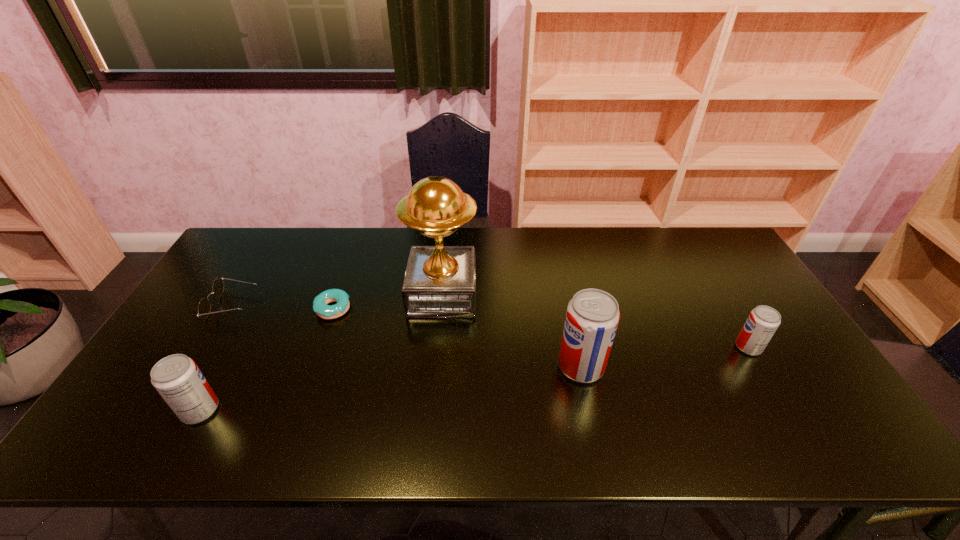
This screenshot has width=960, height=540. I want to click on the fifth tallest object, so click(204, 307).

The width and height of the screenshot is (960, 540). I want to click on vacant region located on the right of the second shortest soda, so click(x=348, y=410).

Image resolution: width=960 pixels, height=540 pixels. In order to click on free region located 0.140m on the left of the tallest soda in this screenshot , I will do `click(504, 366)`.

Locate an element on the screen. This screenshot has width=960, height=540. free location located 0.100m on the front of the fourth tallest object is located at coordinates (773, 389).

This screenshot has width=960, height=540. Identify the location of free location located on the back of the doughnut. (344, 279).

The height and width of the screenshot is (540, 960). I want to click on vacant position located 0.350m on the front-facing side of the tallest object, so [x=591, y=294].

Locate an element on the screen. The image size is (960, 540). blank area located on the front-facing side of the fifth tallest object is located at coordinates (372, 305).

Where is `soda located at the left edge`? The width and height of the screenshot is (960, 540). soda located at the left edge is located at coordinates (177, 378).

Locate an element on the screen. The height and width of the screenshot is (540, 960). spectacles that is at the left edge is located at coordinates (204, 307).

Locate an element on the screen. object situated at the right edge is located at coordinates (763, 321).